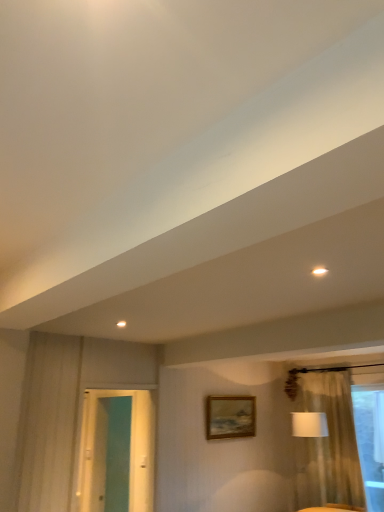
Question: Is white fabric lampshade at right in front of or behind teal glossy door at left in the image?

Choices:
 (A) behind
 (B) front

Answer: (A)

Question: Based on their positions, is white fabric lampshade at right located to the left or right of teal glossy door at left?

Choices:
 (A) left
 (B) right

Answer: (B)

Question: Estimate the real-world distances between objects in this image. Which object is farther from the wooden oil painting at center?

Choices:
 (A) white glossy light fixture at upper right
 (B) beige textured curtain at right
 (C) white fabric lampshade at right
 (D) teal glossy door at left

Answer: (A)

Question: Considering the real-world distances, which object is closest to the white fabric lampshade at right?

Choices:
 (A) teal glossy door at left
 (B) wooden oil painting at center
 (C) white glossy light fixture at upper right
 (D) beige textured curtain at right

Answer: (D)